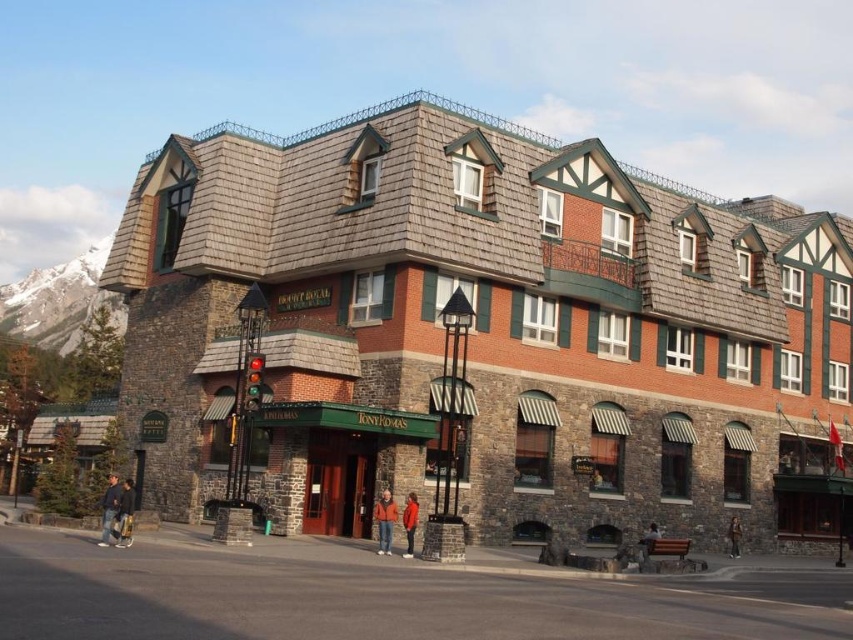
You are standing in front of the building and notice two items in the scene. One is dark blue jeans at lower left and the other is orange jacket at center. Which item appears taller in the image?

The dark blue jeans at lower left appears much taller than the orange jacket at center in the image.

You are standing in front of the Tonton Romas building. You see the brown stone building at center and the dark blue jeans at lower left. Which object is positioned to the left of the other?

The dark blue jeans at lower left is positioned to the left of the brown stone building at center.